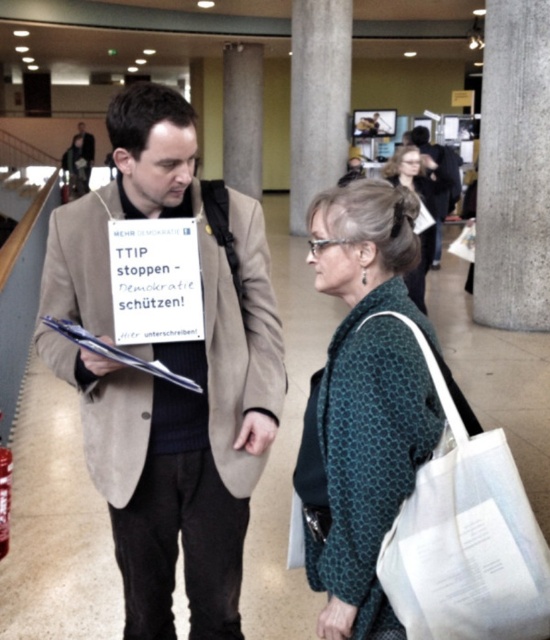
Is suede beige coat at center further to the viewer compared to dark gray suit at upper left?

No, suede beige coat at center is closer to the viewer.

Does suede beige coat at center have a greater width compared to dark gray suit at upper left?

No.

The width and height of the screenshot is (550, 640). I want to click on suede beige coat at center, so click(x=185, y=442).

Is suede beige coat at center shorter than teal dotted sweater at center?

No.

This screenshot has width=550, height=640. Identify the location of suede beige coat at center. (185, 442).

Can you confirm if white fabric bag at lower right is positioned to the right of teal dotted scarf at center?

No, white fabric bag at lower right is not to the right of teal dotted scarf at center.

Between white fabric bag at lower right and teal dotted scarf at center, which one appears on the right side from the viewer's perspective?

teal dotted scarf at center is more to the right.

Where is `white fabric bag at lower right`? Image resolution: width=550 pixels, height=640 pixels. white fabric bag at lower right is located at coordinates (464, 536).

Locate an element on the screen. Image resolution: width=550 pixels, height=640 pixels. white fabric bag at lower right is located at coordinates (464, 536).